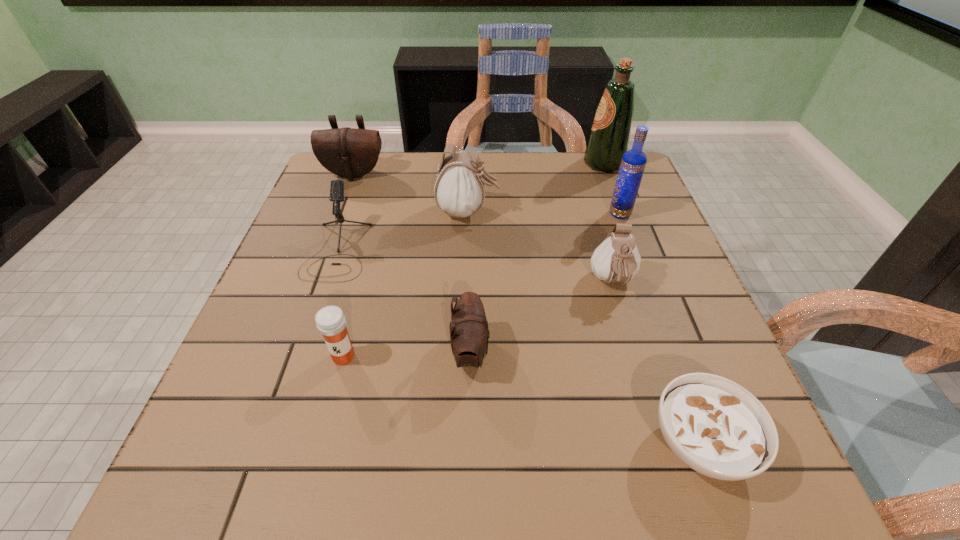
The image size is (960, 540). I want to click on empty space that is in between the nearest object and the right brown pouch, so click(x=586, y=398).

Locate an element on the screen. free space between the microphone and the bigger white pouch is located at coordinates (402, 231).

At what (x,y) coordinates should I click in order to perform the action: click on vacant area between the third nearest pouch and the medicine. Please return your answer as a coordinate pair (x, y). This screenshot has width=960, height=540. Looking at the image, I should click on (406, 284).

Locate an element on the screen. vacant space that's between the vodka and the medicine is located at coordinates (482, 285).

Where is `free area in between the left brown pouch and the microphone`? The height and width of the screenshot is (540, 960). free area in between the left brown pouch and the microphone is located at coordinates (346, 212).

Select which object is the fourth closest to the vodka. Please provide its 2D coordinates. Your answer should be formatted as a tuple, i.e. [(x, y)], where the tuple contains the x and y coordinates of a point satisfying the conditions above.

[(469, 334)]

Find the location of a particular element. The image size is (960, 540). object that can be found as the sixth closest to the white soup bowl is located at coordinates coord(337,186).

Identify which pouch is located as the second nearest to the olive oil. Please provide its 2D coordinates. Your answer should be formatted as a tuple, i.e. [(x, y)], where the tuple contains the x and y coordinates of a point satisfying the conditions above.

[(616, 260)]

You are a GUI agent. You are given a task and a screenshot of the screen. Output one action in this format:
    pyautogui.click(x=<x>, y=<y>)
    Task: Click on the pouch identified as the fourth closest to the green olive oil
    This screenshot has height=540, width=960.
    Given the screenshot: What is the action you would take?
    pyautogui.click(x=469, y=334)

Locate an element on the screen. free space that satisfies the following two spatial constraints: 1. on the stand of the microphone; 2. on the left side of the white soup bowl is located at coordinates (271, 443).